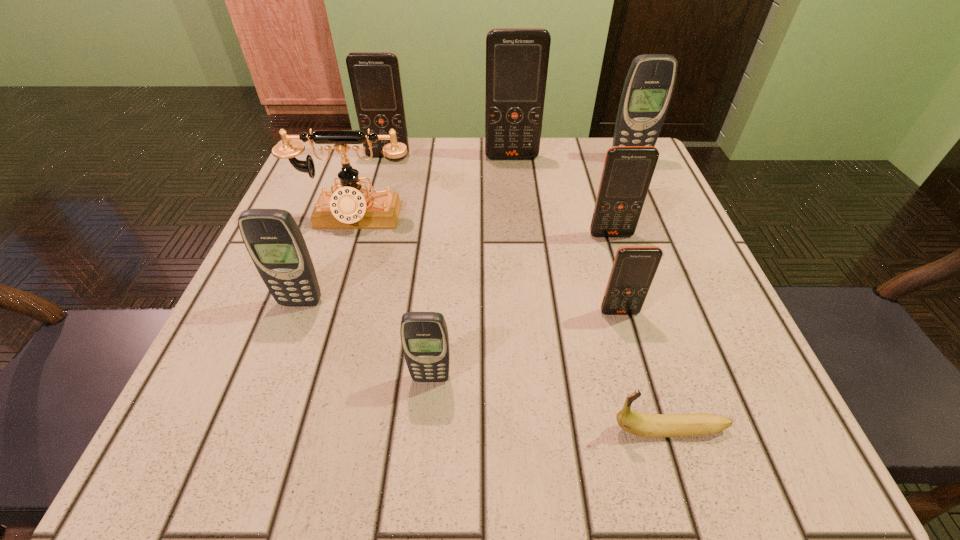
This screenshot has width=960, height=540. In the image, there is a desktop. Identify the location of vacant space at the near right corner. (779, 427).

At what (x,y) coordinates should I click in order to perform the action: click on vacant space that's between the fifth object from right to left and the nearest orange cellular telephone. Please return your answer as a coordinate pair (x, y). Looking at the image, I should click on (565, 235).

The width and height of the screenshot is (960, 540). Identify the location of free point between the biggest orange cellular telephone and the third biggest orange cellular telephone. (562, 196).

Find the location of a particular element. Image resolution: width=960 pixels, height=540 pixels. free point between the nearest orange cellular telephone and the second nearest gray cellular telephone is located at coordinates pos(460,307).

Locate an element on the screen. unoccupied area between the rightmost cellular telephone and the shortest object is located at coordinates (649, 295).

Find the location of a particular element. This screenshot has height=540, width=960. vacant area that lies between the leftmost orange cellular telephone and the second biggest gray cellular telephone is located at coordinates (345, 229).

At what (x,y) coordinates should I click in order to perform the action: click on free space between the leftmost orange cellular telephone and the tallest object. Please return your answer as a coordinate pair (x, y). The image size is (960, 540). Looking at the image, I should click on (450, 157).

This screenshot has width=960, height=540. Find the location of `vacant space that's between the telephone and the seventh farthest object`. vacant space that's between the telephone and the seventh farthest object is located at coordinates (487, 265).

Find the location of a particular element. This screenshot has height=540, width=960. the seventh closest object to the banana is located at coordinates (517, 59).

Locate an element on the screen. Image resolution: width=960 pixels, height=540 pixels. object that stands as the third closest to the rightmost cellular telephone is located at coordinates (634, 267).